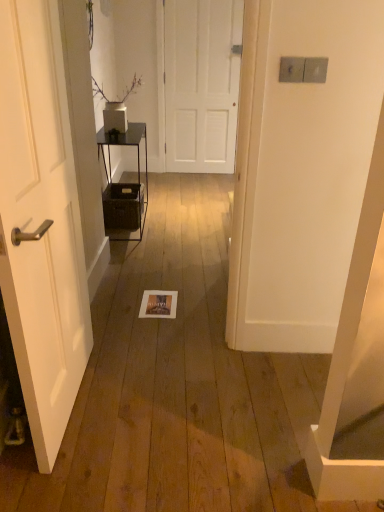
Locate an element on the screen. This screenshot has width=384, height=512. white matte door at center, the 1th door from the top is located at coordinates (201, 84).

Where is `metallic black shelf at center`? metallic black shelf at center is located at coordinates (125, 145).

Locate an element on the screen. white matte door at left, the second door from the top is located at coordinates (x=41, y=222).

Where is `door above the metallic black shelf at center (from the image's perspective)`? This screenshot has width=384, height=512. door above the metallic black shelf at center (from the image's perspective) is located at coordinates (201, 84).

Which is farther from the camera, (x=168, y=161) or (x=132, y=133)?

The point (x=168, y=161) is farther from the camera.

Consider the image. Is white matte door at center, the 2th door positioned from the bottom, in contact with metallic black shelf at center?

No, white matte door at center, the 2th door positioned from the bottom, is not with metallic black shelf at center.

In terms of size, does white matte door at center, marked as the second door in a front-to-back arrangement, appear bigger or smaller than metallic black shelf at center?

In the image, white matte door at center, marked as the second door in a front-to-back arrangement, appears to be smaller than metallic black shelf at center.

Is metallic black shelf at center looking in the opposite direction of white matte door at center, the 1th door from the top?

metallic black shelf at center does not have its back to white matte door at center, the 1th door from the top.

Can you confirm if metallic black shelf at center is wider than white matte door at center, marked as the 1th door in a back-to-front arrangement?

Yes, metallic black shelf at center is wider than white matte door at center, marked as the 1th door in a back-to-front arrangement.

Which is correct: metallic black shelf at center is inside white matte door at center, the 1th door from the top, or outside of it?

metallic black shelf at center is not enclosed by white matte door at center, the 1th door from the top.

Is white matte door at left, the first door in the bottom-to-top sequence, wider than white matte door at center, marked as the 1th door in a back-to-front arrangement?

Indeed, white matte door at left, the first door in the bottom-to-top sequence, has a greater width compared to white matte door at center, marked as the 1th door in a back-to-front arrangement.

Considering the sizes of white matte door at left, the 1th door in the left-to-right sequence, and white matte door at center, marked as the 1th door in a back-to-front arrangement, in the image, is white matte door at left, the 1th door in the left-to-right sequence, bigger or smaller than white matte door at center, marked as the 1th door in a back-to-front arrangement,?

white matte door at left, the 1th door in the left-to-right sequence, is bigger than white matte door at center, marked as the 1th door in a back-to-front arrangement.

From the image's perspective, which is below, white matte door at left, the second door from the top, or white matte door at center, marked as the 1th door in a back-to-front arrangement?

white matte door at left, the second door from the top, from the image's perspective.

Who is taller, white matte door at left, the second door in the right-to-left sequence, or white matte door at center, the 2th door positioned from the bottom?

white matte door at center, the 2th door positioned from the bottom.

Does point (104, 135) come behind point (57, 82)?

Yes, point (104, 135) is farther from viewer.

Is metallic black shelf at center closer to camera compared to white matte door at left, the 1th door in the left-to-right sequence?

No, the depth of metallic black shelf at center is greater than that of white matte door at left, the 1th door in the left-to-right sequence.

Is metallic black shelf at center at the left side of white matte door at left, which is the first door from front to back?

Correct, you'll find metallic black shelf at center to the left of white matte door at left, which is the first door from front to back.

Looking at the image, does metallic black shelf at center seem bigger or smaller compared to white matte door at left, the 1th door in the left-to-right sequence?

Considering their sizes, metallic black shelf at center takes up more space than white matte door at left, the 1th door in the left-to-right sequence.

Consider the image. Is white matte door at left, the first door in the bottom-to-top sequence, with metallic black shelf at center?

No, white matte door at left, the first door in the bottom-to-top sequence, is not touching metallic black shelf at center.

Who is taller, white matte door at left, the second door in the right-to-left sequence, or metallic black shelf at center?

Standing taller between the two is white matte door at left, the second door in the right-to-left sequence.

Which of these two, white matte door at left, the first door in the bottom-to-top sequence, or metallic black shelf at center, is bigger?

metallic black shelf at center.

Considering the positions of objects white matte door at left, the second door in the right-to-left sequence, and metallic black shelf at center in the image provided, who is more to the right, white matte door at left, the second door in the right-to-left sequence, or metallic black shelf at center?

white matte door at left, the second door in the right-to-left sequence.

Can you confirm if white matte door at center, marked as the 1th door in a back-to-front arrangement, is thinner than white matte door at left, the second door from the top?

Yes, white matte door at center, marked as the 1th door in a back-to-front arrangement, is thinner than white matte door at left, the second door from the top.

Consider the image. From the image's perspective, does white matte door at center, marked as the second door in a front-to-back arrangement, appear higher than white matte door at left, the second door in the back-to-front sequence?

Yes.

Considering the positions of objects white matte door at center, marked as the second door in a front-to-back arrangement, and white matte door at left, the second door in the right-to-left sequence, in the image provided, who is more to the left, white matte door at center, marked as the second door in a front-to-back arrangement, or white matte door at left, the second door in the right-to-left sequence,?

white matte door at left, the second door in the right-to-left sequence.

Locate an element on the screen. furniture below the white matte door at center, which is the 2th door from left to right (from the image's perspective) is located at coordinates (125, 145).

Locate an element on the screen. The image size is (384, 512). the 2nd door directly above the metallic black shelf at center (from a real-world perspective) is located at coordinates (201, 84).

When comparing their distances from white matte door at left, the second door in the right-to-left sequence, does metallic black shelf at center or white matte door at center, marked as the second door in a front-to-back arrangement, seem closer?

metallic black shelf at center.

From the image, which object appears to be nearer to white matte door at left, which is the first door from front to back, white matte door at center, marked as the second door in a front-to-back arrangement, or metallic black shelf at center?

The object closer to white matte door at left, which is the first door from front to back, is metallic black shelf at center.

When comparing their distances from metallic black shelf at center, does white matte door at center, marked as the second door in a front-to-back arrangement, or white matte door at left, which is the first door from front to back, seem further?

white matte door at center, marked as the second door in a front-to-back arrangement, is further to metallic black shelf at center.

Looking at the image, which one is located further to metallic black shelf at center, white matte door at left, the second door in the back-to-front sequence, or white matte door at center, marked as the second door in a front-to-back arrangement?

Among the two, white matte door at center, marked as the second door in a front-to-back arrangement, is located further to metallic black shelf at center.

Estimate the real-world distances between objects in this image. Which object is closer to white matte door at center, marked as the 1th door in a back-to-front arrangement, white matte door at left, the second door in the back-to-front sequence, or metallic black shelf at center?

Among the two, metallic black shelf at center is located nearer to white matte door at center, marked as the 1th door in a back-to-front arrangement.

Which object lies further to the anchor point white matte door at center, marked as the second door in a front-to-back arrangement, metallic black shelf at center or white matte door at left, the second door from the top?

Among the two, white matte door at left, the second door from the top, is located further to white matte door at center, marked as the second door in a front-to-back arrangement.

You are a GUI agent. You are given a task and a screenshot of the screen. Output one action in this format:
    pyautogui.click(x=<x>, y=<y>)
    Task: Click on the furniture between white matte door at left, the 1th door in the left-to-right sequence, and white matte door at center, marked as the second door in a front-to-back arrangement, along the z-axis
    Image resolution: width=384 pixels, height=512 pixels.
    Given the screenshot: What is the action you would take?
    pyautogui.click(x=125, y=145)